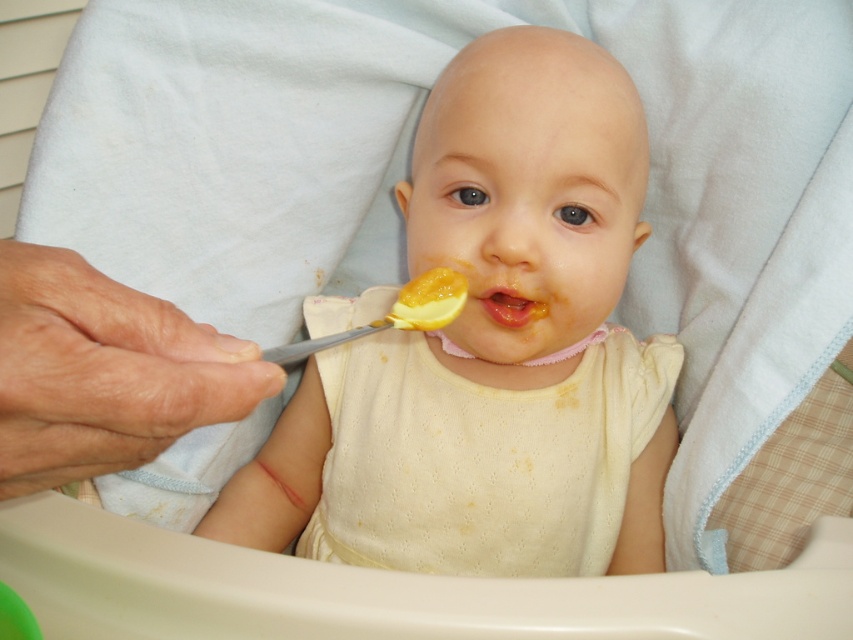
What object is located at the coordinates point (491, 349) in the image?

The point (491, 349) is on the yellow matte spoon at center.

You are a caregiver trying to feed the baby. The baby is looking at the yellow matte food at center. Where should you move the yellow matte spoon at center to ensure it is positioned correctly for feeding?

The yellow matte spoon at center should be moved above the yellow matte food at center because currently it is located below it, and to properly feed the baby, the spoon needs to be positioned above the food to guide it towards the baby.

You are a caregiver trying to feed a baby using the yellow matte spoon at center and the white dotted fabric bib at center. Which object is taller when viewed from above?

The yellow matte spoon at center is taller than the white dotted fabric bib at center.